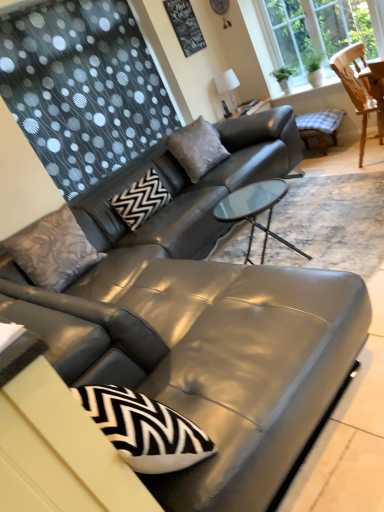
Question: Is black zigzag-patterned pillow at center, which appears as the 2th pillow when viewed from the right, bigger or smaller than black textured board at upper center?

Choices:
 (A) big
 (B) small

Answer: (A)

Question: Choose the correct answer: Is black zigzag-patterned pillow at center, which appears as the 2th pillow when viewed from the right, inside black textured board at upper center or outside it?

Choices:
 (A) outside
 (B) inside

Answer: (A)

Question: Which of these objects is positioned closest to the black zigzag-patterned pillow at center, the second pillow from the left?

Choices:
 (A) white glass lampshade at upper right
 (B) transparent glass window at upper right
 (C) black textured board at upper center
 (D) matte gray cushion at center, acting as the first pillow starting from the right
 (E) wooden chair at upper right

Answer: (D)

Question: Which is nearer to the transparent glass window at upper right?

Choices:
 (A) matte gray cushion at center, which is the third pillow in left-to-right order
 (B) black zigzag-patterned pillow at center, which appears as the 2th pillow when viewed from the right
 (C) black textured board at upper center
 (D) white glass lampshade at upper right
 (E) wooden chair at upper right

Answer: (E)